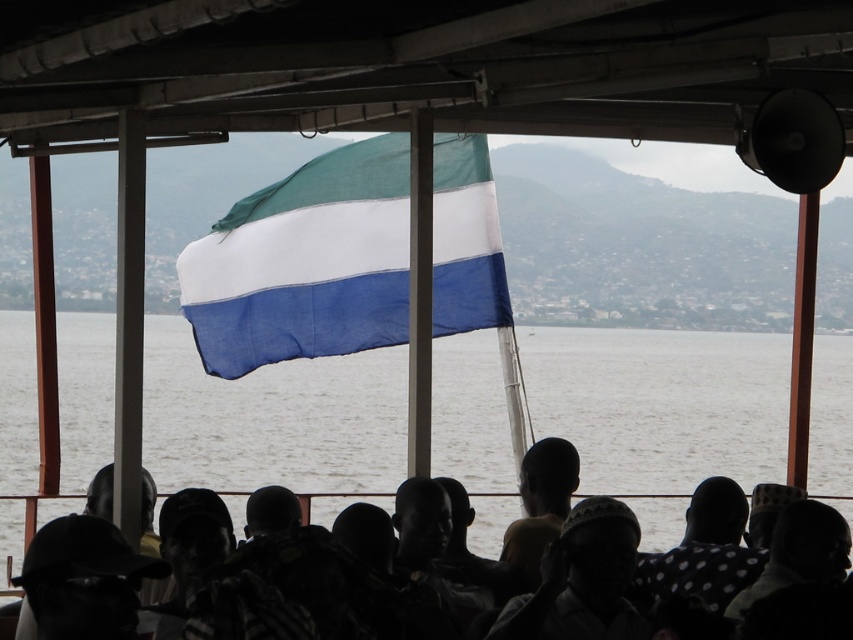
Question: Which object is the closest to the blue fabric water at center?

Choices:
 (A) textured fabric flag at center
 (B) silhouette headscarf at center

Answer: (A)

Question: Can you confirm if textured fabric flag at center is thinner than silhouette headscarf at center?

Choices:
 (A) yes
 (B) no

Answer: (B)

Question: Which point appears farthest from the camera in this image?

Choices:
 (A) (724, 492)
 (B) (497, 532)

Answer: (B)

Question: Is blue fabric water at center to the left of textured fabric flag at center from the viewer's perspective?

Choices:
 (A) no
 (B) yes

Answer: (A)

Question: Is textured fabric flag at center thinner than silhouette headscarf at center?

Choices:
 (A) yes
 (B) no

Answer: (B)

Question: Among these objects, which one is farthest from the camera?

Choices:
 (A) textured fabric flag at center
 (B) silhouette headscarf at center
 (C) blue fabric water at center

Answer: (B)